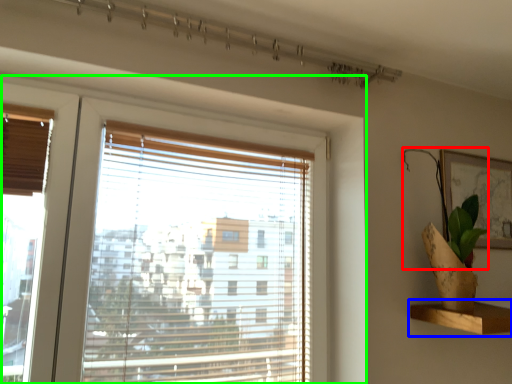
Question: Based on their relative distances, which object is farther from plant (highlighted by a red box)? Choose from shelf (highlighted by a blue box) and window (highlighted by a green box).

Choices:
 (A) shelf
 (B) window

Answer: (B)